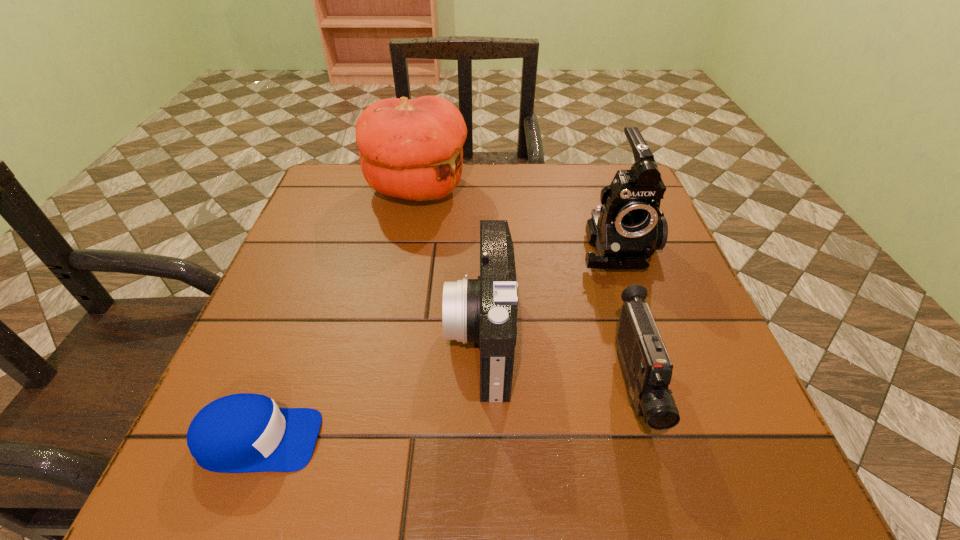
This screenshot has height=540, width=960. I want to click on camcorder that is the closest to the farthest camcorder, so click(647, 369).

Where is `free spot that satisfies the following two spatial constraints: 1. on the front-facing side of the fourth tallest object; 2. on the front-facing side of the shortest object`? free spot that satisfies the following two spatial constraints: 1. on the front-facing side of the fourth tallest object; 2. on the front-facing side of the shortest object is located at coordinates (647, 440).

Identify the location of free point that satisfies the following two spatial constraints: 1. on the lens mount of the farthest camcorder; 2. on the front-facing side of the shortest object. (683, 440).

This screenshot has width=960, height=540. What are the coordinates of `vacant point that satisfies the following two spatial constraints: 1. on the lens mount of the tallest camcorder; 2. on the front-facing side of the shortest object` in the screenshot? It's located at (683, 440).